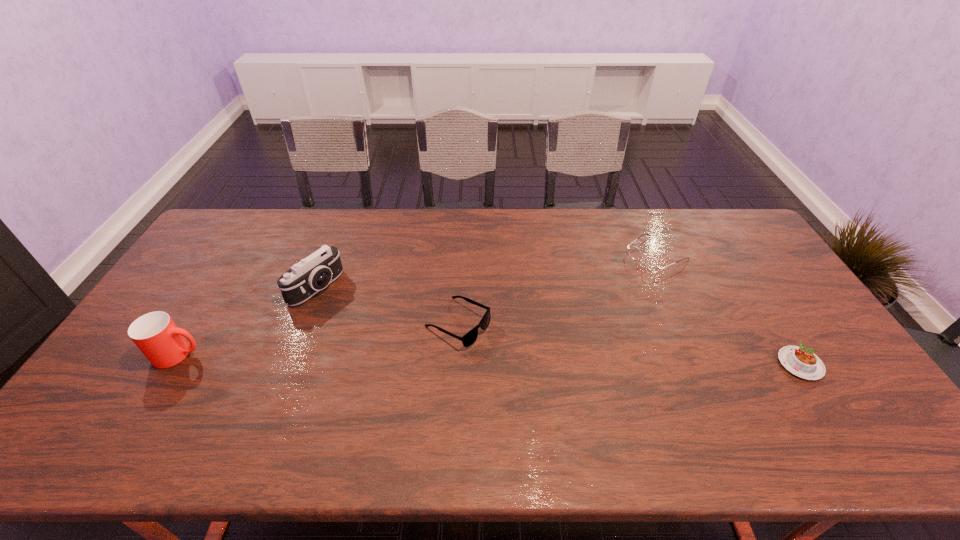
The width and height of the screenshot is (960, 540). What are the coordinates of `vacant space positioned 0.060m through the lenses of the spectacles` in the screenshot? It's located at (625, 274).

Where is `vacant area situated on the front-facing side of the third object from left to right`? This screenshot has width=960, height=540. vacant area situated on the front-facing side of the third object from left to right is located at coordinates (563, 380).

Where is `vacant space located 0.280m on the front-facing side of the third object from left to right`? vacant space located 0.280m on the front-facing side of the third object from left to right is located at coordinates (576, 387).

Locate an element on the screen. The width and height of the screenshot is (960, 540). free space located 0.130m on the front-facing side of the third object from left to right is located at coordinates (525, 360).

Where is `free space located on the front lens of the camera`? The width and height of the screenshot is (960, 540). free space located on the front lens of the camera is located at coordinates (349, 311).

Locate an element on the screen. free point located on the front lens of the camera is located at coordinates (429, 360).

Locate an element on the screen. vacant space positioned on the front lens of the camera is located at coordinates (359, 316).

Where is `object that is at the far edge`? The width and height of the screenshot is (960, 540). object that is at the far edge is located at coordinates (651, 263).

You are a GUI agent. You are given a task and a screenshot of the screen. Output one action in this format:
    pyautogui.click(x=<x>, y=<y>)
    Task: Click on the object at the left edge
    
    Given the screenshot: What is the action you would take?
    pyautogui.click(x=156, y=335)

Where is `object that is at the right edge`? The height and width of the screenshot is (540, 960). object that is at the right edge is located at coordinates (802, 362).